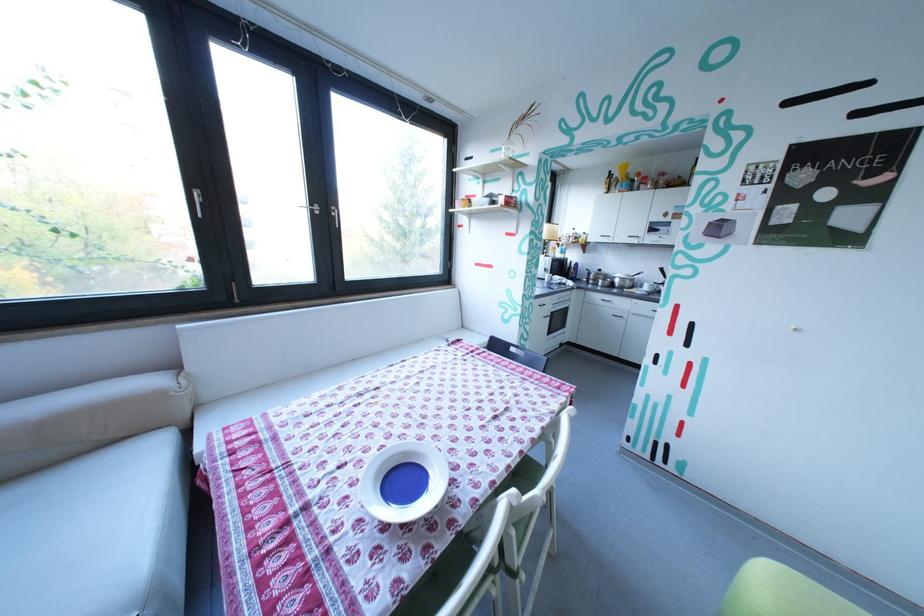
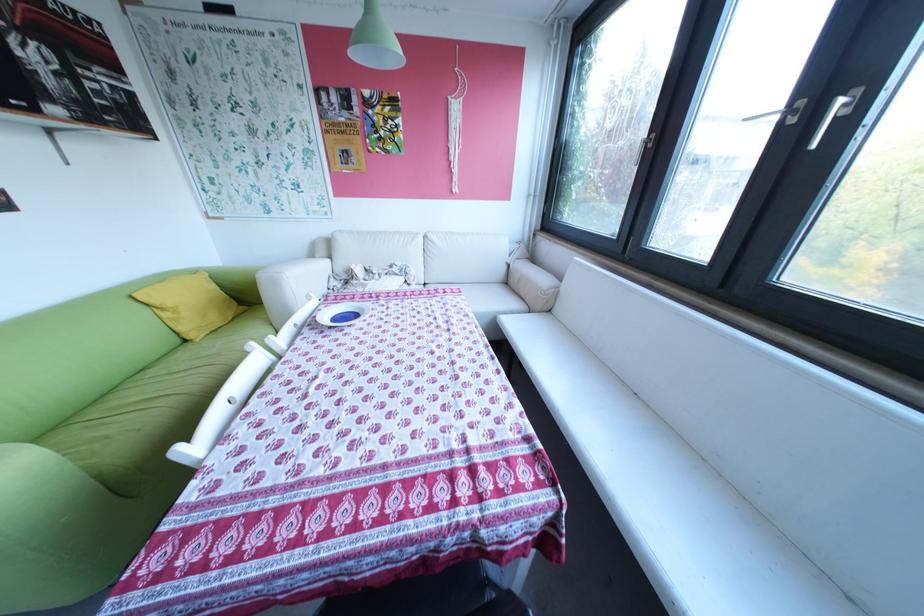
Question: I am providing you with two images of the same scene from different viewpoints. Please identify which objects are invisible in image2.

Choices:
 (A) black round knob
 (B) chair sitting surface
 (C) white sofa sitting surface
 (D) blue and white bowl

Answer: (B)